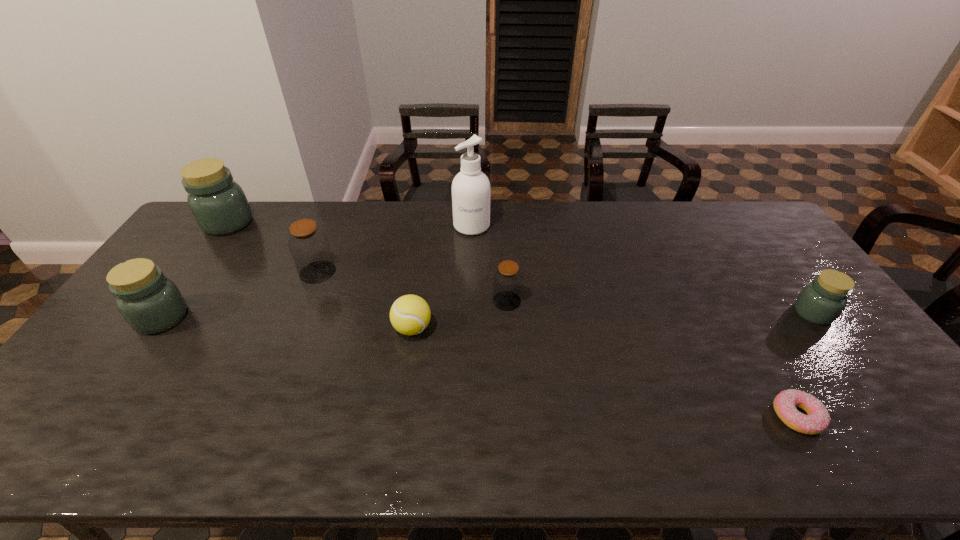
I want to click on the fifth object from left to right, so click(x=471, y=189).

Find the location of `the tallest object`. the tallest object is located at coordinates (471, 189).

Locate an element on the screen. the farthest green jar is located at coordinates (218, 204).

Locate an element on the screen. The height and width of the screenshot is (540, 960). the tallest jar is located at coordinates click(x=218, y=204).

The image size is (960, 540). In order to click on the farther brown jar in this screenshot , I will do `click(308, 244)`.

Where is `the left brown jar`? This screenshot has width=960, height=540. the left brown jar is located at coordinates (308, 244).

Identify the location of the second smallest green jar. This screenshot has height=540, width=960. (150, 303).

This screenshot has width=960, height=540. Find the location of `the right brown jar`. the right brown jar is located at coordinates (507, 280).

Identify the location of the nearer brown jar. (507, 280).

This screenshot has width=960, height=540. I want to click on the rightmost object, so click(x=821, y=302).